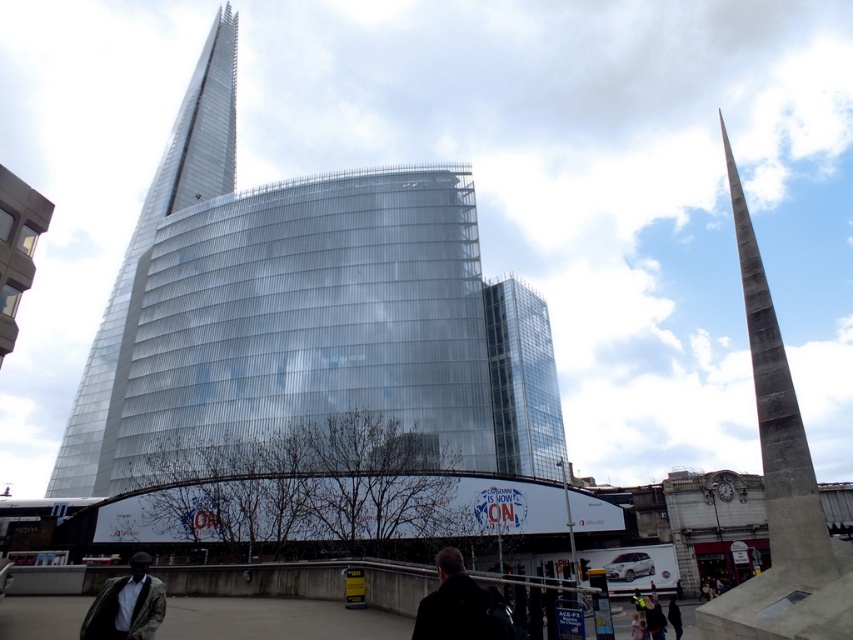
Question: Which point is closer to the camera?

Choices:
 (A) (194, 140)
 (B) (148, 625)
 (C) (670, 618)
 (D) (457, 627)

Answer: (D)

Question: Is the position of polished glass spire at upper left less distant than that of transparent glass tower at center?

Choices:
 (A) yes
 (B) no

Answer: (B)

Question: From the image, what is the correct spatial relationship of polished glass spire at upper left in relation to dark hair at center?

Choices:
 (A) above
 (B) below

Answer: (A)

Question: Is light brown leather jacket at lower left above dark hair at center?

Choices:
 (A) yes
 (B) no

Answer: (A)

Question: Which object is the closest to the concrete obelisk at right?

Choices:
 (A) polished glass spire at upper left
 (B) transparent glass tower at center
 (C) light brown leather jacket at lower left

Answer: (B)

Question: Which object is positioned closest to the light brown leather jacket at lower left?

Choices:
 (A) dark brown leather jacket at lower center
 (B) transparent glass tower at center

Answer: (A)